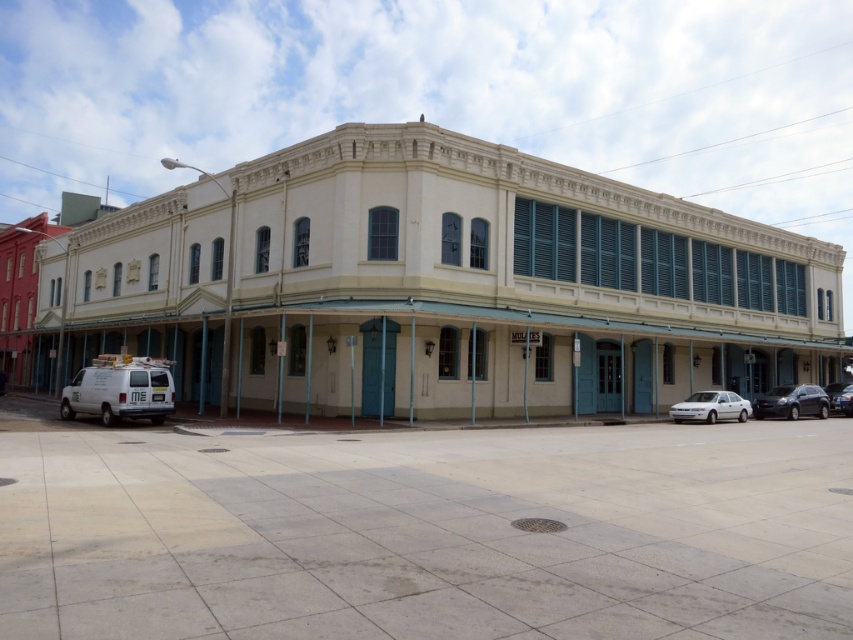
Question: Does matte white building at center have a lesser width compared to white glossy sedan at lower center?

Choices:
 (A) no
 (B) yes

Answer: (A)

Question: Which object is farther from the camera taking this photo?

Choices:
 (A) black matte car at lower right
 (B) white glossy sedan at lower center
 (C) shiny black car at lower right

Answer: (C)

Question: Based on their relative distances, which object is nearer to the shiny black car at lower right?

Choices:
 (A) matte white building at center
 (B) black matte car at lower right
 (C) white matte van at lower left
 (D) white glossy sedan at lower center

Answer: (B)

Question: Does black matte car at lower right appear on the left side of white glossy sedan at lower center?

Choices:
 (A) no
 (B) yes

Answer: (A)

Question: Considering the real-world distances, which object is farthest from the white matte van at lower left?

Choices:
 (A) matte white building at center
 (B) white glossy sedan at lower center
 (C) black matte car at lower right

Answer: (C)

Question: Where is black matte car at lower right located in relation to white glossy sedan at lower center in the image?

Choices:
 (A) left
 (B) right

Answer: (B)